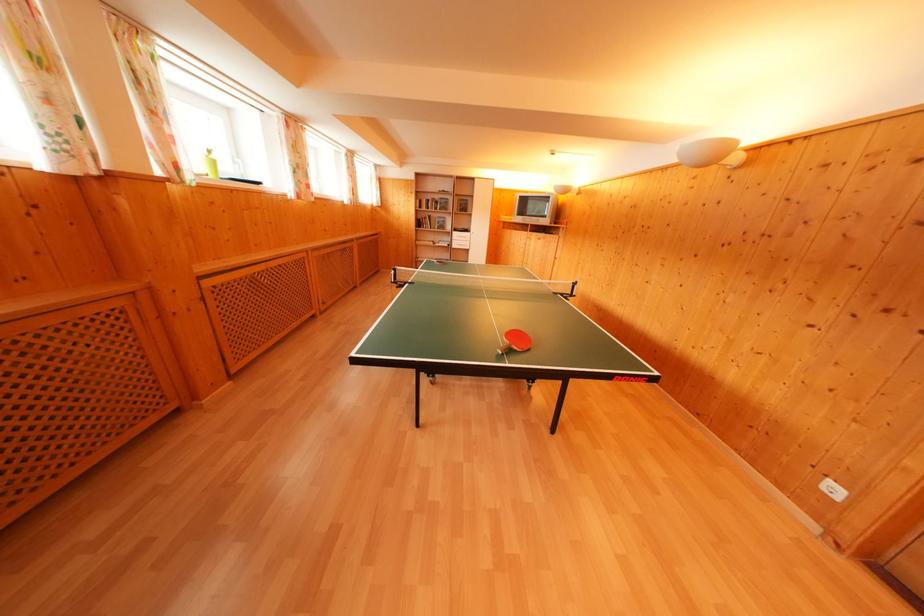
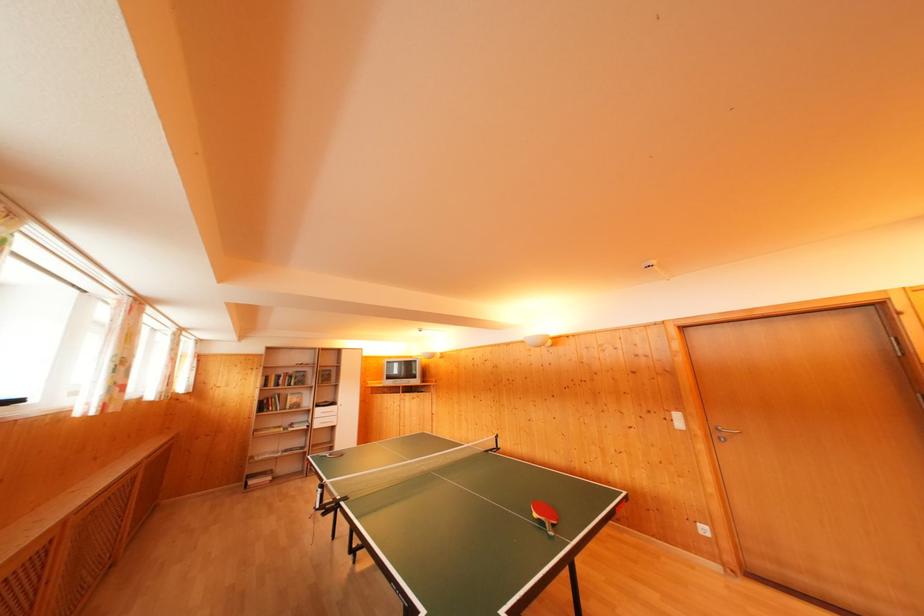
Where in the second image is the point corresponding to the point at 459,238 from the first image?

(322, 416)